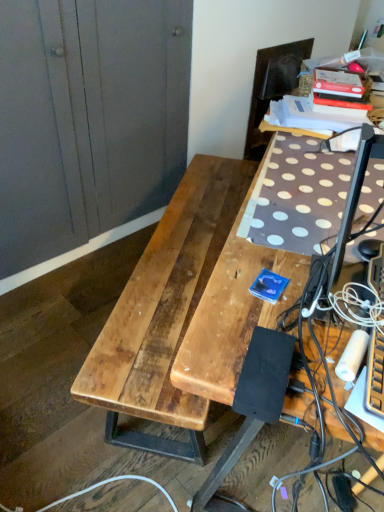
The image size is (384, 512). What do you see at coordinates (233, 310) in the screenshot?
I see `brown wooden desk at center` at bounding box center [233, 310].

The image size is (384, 512). Find the location of `black rubber extension cord at lower right`. black rubber extension cord at lower right is located at coordinates (344, 493).

This screenshot has height=512, width=384. Describe the element at coordinates (88, 119) in the screenshot. I see `wooden dresser at left` at that location.

Find the location of a particular element. The height and width of the screenshot is (512, 384). dark brown leather swivel chair at upper right is located at coordinates (272, 87).

The image size is (384, 512). What are the coordinates of `brown wooden desk at center` in the screenshot? It's located at (233, 310).

Between dark brown leather swivel chair at upper right and natural wood table at center, which one is positioned behind?

dark brown leather swivel chair at upper right is further from the camera.

From the picture: Is dark brown leather swivel chair at upper right bigger or smaller than natural wood table at center?

Considering their sizes, dark brown leather swivel chair at upper right takes up less space than natural wood table at center.

Does point (261, 56) lie in front of point (124, 301)?

No.

From the image's perspective, is dark brown leather swivel chair at upper right over natural wood table at center?

Yes, from the image's perspective, dark brown leather swivel chair at upper right is above natural wood table at center.

Is dark brown leather swivel chair at upper right facing towards brown wooden desk at center?

No, dark brown leather swivel chair at upper right does not turn towards brown wooden desk at center.

Is dark brown leather swivel chair at upper right positioned behind brown wooden desk at center?

Yes, it is.

Is the surface of dark brown leather swivel chair at upper right in direct contact with brown wooden desk at center?

dark brown leather swivel chair at upper right is not next to brown wooden desk at center, and they're not touching.

Is brown wooden desk at center wider than wooden dresser at left?

Correct, the width of brown wooden desk at center exceeds that of wooden dresser at left.

Is point (245, 308) positioned after point (45, 203)?

No.

Considering the positions of objects brown wooden desk at center and wooden dresser at left in the image provided, who is more to the left, brown wooden desk at center or wooden dresser at left?

From the viewer's perspective, wooden dresser at left appears more on the left side.

Image resolution: width=384 pixels, height=512 pixels. I want to click on extension cord below the dark brown leather swivel chair at upper right (from a real-world perspective), so click(x=344, y=493).

Measure the distance between black rubber extension cord at lower right and dark brown leather swivel chair at upper right.

A distance of 5.95 feet exists between black rubber extension cord at lower right and dark brown leather swivel chair at upper right.

From a real-world perspective, is black rubber extension cord at lower right under dark brown leather swivel chair at upper right?

Yes, from a real-world perspective, black rubber extension cord at lower right is under dark brown leather swivel chair at upper right.

What's the angular difference between black rubber extension cord at lower right and dark brown leather swivel chair at upper right's facing directions?

black rubber extension cord at lower right and dark brown leather swivel chair at upper right are facing 42.5 degrees away from each other.

Considering the sizes of objects wooden dresser at left and dark brown leather swivel chair at upper right in the image provided, who is thinner, wooden dresser at left or dark brown leather swivel chair at upper right?

Thinner between the two is dark brown leather swivel chair at upper right.

Which of these two, wooden dresser at left or dark brown leather swivel chair at upper right, stands taller?

wooden dresser at left.

Considering the positions of points (118, 202) and (259, 59), is point (118, 202) closer to camera compared to point (259, 59)?

Yes.

In the image, there is a wooden dresser at left. Identify the location of swivel chair above it (from the image's perspective). (272, 87).

Does natural wood table at center appear on the left side of black rubber extension cord at lower right?

Yes, natural wood table at center is to the left of black rubber extension cord at lower right.

Can you tell me how much natural wood table at center and black rubber extension cord at lower right differ in facing direction?

74.5 degrees separate the facing orientations of natural wood table at center and black rubber extension cord at lower right.

Is the depth of natural wood table at center greater than that of black rubber extension cord at lower right?

No, it is in front of black rubber extension cord at lower right.

Could you tell me if natural wood table at center is facing black rubber extension cord at lower right?

Yes, natural wood table at center is oriented towards black rubber extension cord at lower right.

At what (x,y) coordinates should I click in order to perform the action: click on extension cord on the right of wooden dresser at left. Please return your answer as a coordinate pair (x, y). This screenshot has width=384, height=512. Looking at the image, I should click on pyautogui.click(x=344, y=493).

Considering the sizes of wooden dresser at left and black rubber extension cord at lower right in the image, is wooden dresser at left wider or thinner than black rubber extension cord at lower right?

In the image, wooden dresser at left appears to be wider than black rubber extension cord at lower right.

From a real-world perspective, is wooden dresser at left physically located above or below black rubber extension cord at lower right?

From a real-world perspective, wooden dresser at left is physically above black rubber extension cord at lower right.

Would you say wooden dresser at left is inside or outside black rubber extension cord at lower right?

wooden dresser at left cannot be found inside black rubber extension cord at lower right.

Locate an element on the screen. This screenshot has height=512, width=384. table below the dark brown leather swivel chair at upper right (from a real-world perspective) is located at coordinates (164, 313).

Identify the location of swivel chair above the brown wooden desk at center (from a real-world perspective). The image size is (384, 512). (272, 87).

Which object lies nearer to the anchor point black rubber extension cord at lower right, dark brown leather swivel chair at upper right or brown wooden desk at center?

brown wooden desk at center is positioned closer to the anchor black rubber extension cord at lower right.

Estimate the real-world distances between objects in this image. Which object is further from natural wood table at center, black rubber extension cord at lower right or wooden dresser at left?

black rubber extension cord at lower right.

Looking at the image, which one is located closer to brown wooden desk at center, black rubber extension cord at lower right or dark brown leather swivel chair at upper right?

black rubber extension cord at lower right is positioned closer to the anchor brown wooden desk at center.

Estimate the real-world distances between objects in this image. Which object is further from natural wood table at center, black rubber extension cord at lower right or brown wooden desk at center?

black rubber extension cord at lower right lies further to natural wood table at center than the other object.

Considering their positions, is natural wood table at center positioned further to dark brown leather swivel chair at upper right than wooden dresser at left?

Among the two, wooden dresser at left is located further to dark brown leather swivel chair at upper right.

Considering their positions, is wooden dresser at left positioned further to brown wooden desk at center than dark brown leather swivel chair at upper right?

The object further to brown wooden desk at center is dark brown leather swivel chair at upper right.

Estimate the real-world distances between objects in this image. Which object is closer to wooden dresser at left, black rubber extension cord at lower right or brown wooden desk at center?

Based on the image, brown wooden desk at center appears to be nearer to wooden dresser at left.

When comparing their distances from wooden dresser at left, does natural wood table at center or dark brown leather swivel chair at upper right seem closer?

Based on the image, natural wood table at center appears to be nearer to wooden dresser at left.

Find the location of a particular element. The height and width of the screenshot is (512, 384). table between brown wooden desk at center and black rubber extension cord at lower right vertically is located at coordinates (164, 313).

The height and width of the screenshot is (512, 384). I want to click on table between dark brown leather swivel chair at upper right and black rubber extension cord at lower right in the up-down direction, so coord(164,313).

Locate an element on the screen. desk between dark brown leather swivel chair at upper right and black rubber extension cord at lower right in the vertical direction is located at coordinates (233, 310).

Where is `table located between brown wooden desk at center and dark brown leather swivel chair at upper right in the depth direction`? Image resolution: width=384 pixels, height=512 pixels. table located between brown wooden desk at center and dark brown leather swivel chair at upper right in the depth direction is located at coordinates (164, 313).